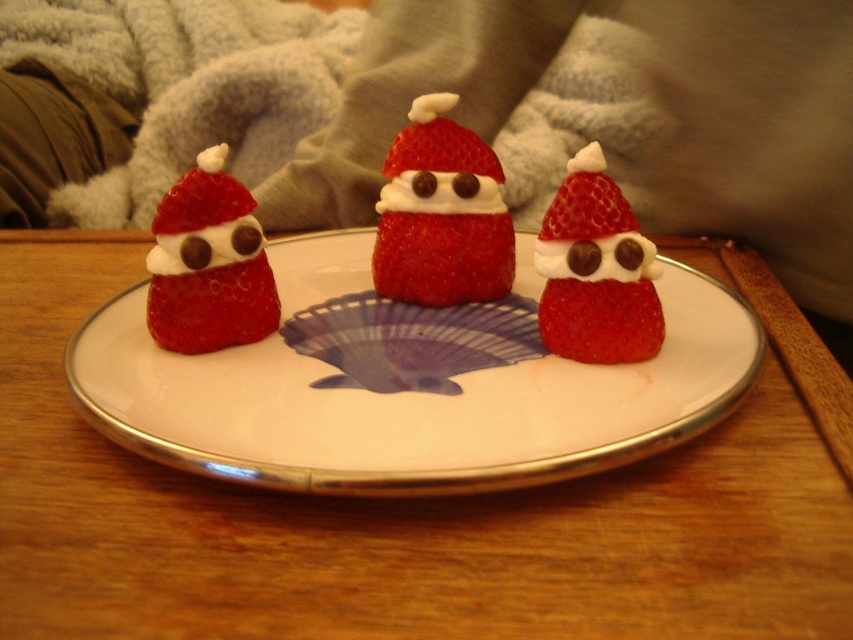
Who is lower down, matte chocolate strawberry at center or matte chocolate strawberry at left?

matte chocolate strawberry at center is below.

Identify the location of matte chocolate strawberry at center. (595, 272).

Who is positioned more to the left, fuzzy gray blanket at upper center or matte chocolate strawberry at center?

From the viewer's perspective, fuzzy gray blanket at upper center appears more on the left side.

Between fuzzy gray blanket at upper center and matte chocolate strawberry at center, which one has less height?

With less height is matte chocolate strawberry at center.

The height and width of the screenshot is (640, 853). What do you see at coordinates (187, 84) in the screenshot?
I see `fuzzy gray blanket at upper center` at bounding box center [187, 84].

Find the location of `fuzzy gray blanket at upper center`. fuzzy gray blanket at upper center is located at coordinates (187, 84).

Who is positioned more to the right, white glossy plate at center or fuzzy gray blanket at upper center?

white glossy plate at center

Between point (573, 371) and point (215, 58), which one is positioned behind?

Point (215, 58)

Is point (521, 264) behind point (267, 16)?

No, it is not.

This screenshot has height=640, width=853. In order to click on white glossy plate at center in this screenshot , I will do `click(412, 404)`.